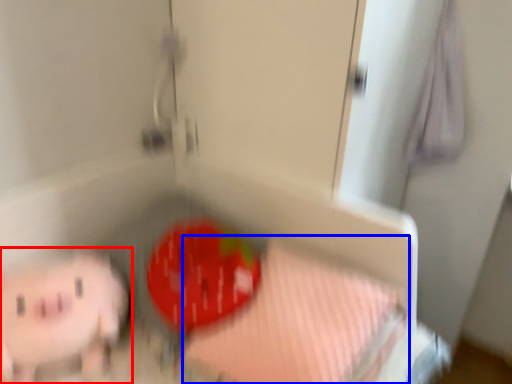
Question: Among these objects, which one is nearest to the camera, toy (highlighted by a red box) or sheet (highlighted by a blue box)?

Choices:
 (A) toy
 (B) sheet

Answer: (B)